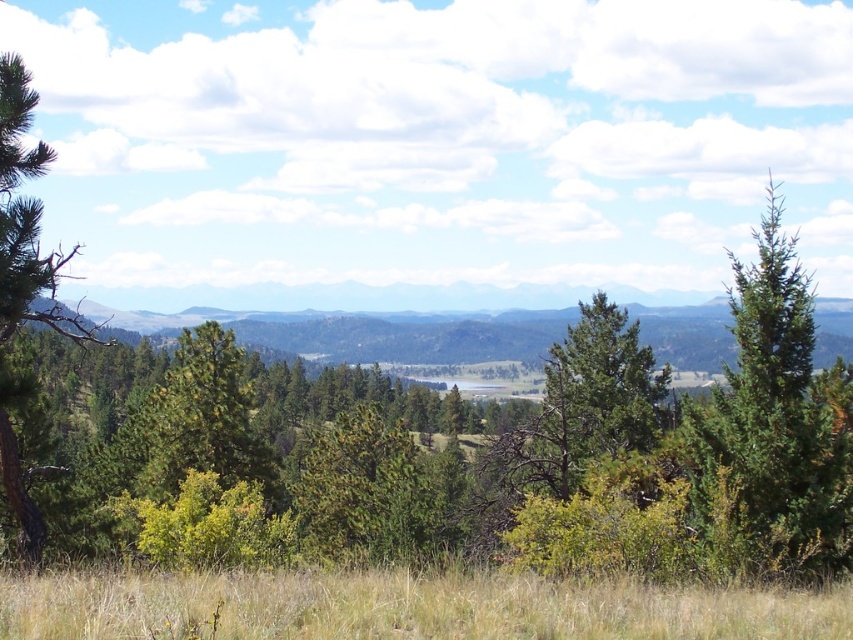
Does green needle-like at right appear over green matte tree at left?

Correct, green needle-like at right is located above green matte tree at left.

Between green needle-like at right and green matte tree at left, which one is positioned higher?

green needle-like at right is above.

In order to click on green needle-like at right in this screenshot , I will do `click(775, 422)`.

Is green grass at lower center bigger than green needle-like at right?

Incorrect, green grass at lower center is not larger than green needle-like at right.

Which is below, green grass at lower center or green needle-like at right?

green grass at lower center is below.

Identify the location of green grass at lower center. The image size is (853, 640). (404, 605).

Is green grass at lower center positioned at the back of green matte tree at left?

No, it is not.

Find the location of `green grass at lower center`. green grass at lower center is located at coordinates (404, 605).